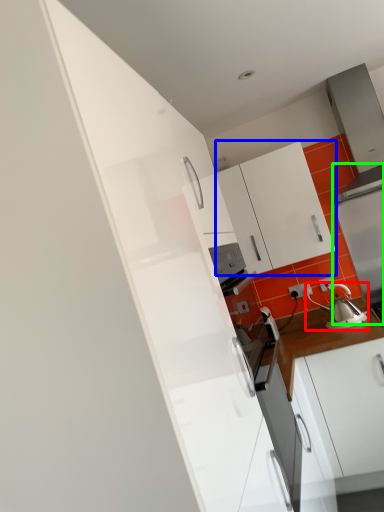
Question: Based on their relative distances, which object is nearer to tea pot (highlighted by a red box)? Choose from cabinetry (highlighted by a blue box) and appliance (highlighted by a green box).

Choices:
 (A) cabinetry
 (B) appliance

Answer: (B)